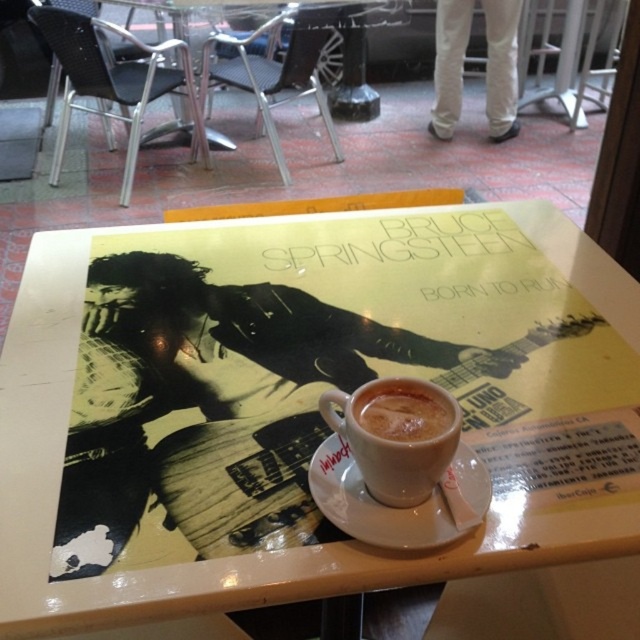
Question: Observing the image, what is the correct spatial positioning of cappuccino foam cup at center in reference to white ceramic saucer at center?

Choices:
 (A) right
 (B) left

Answer: (B)

Question: Can you confirm if white glossy table at center is positioned to the right of white frothy coffee at center?

Choices:
 (A) no
 (B) yes

Answer: (A)

Question: Which of the following is the closest to the observer?

Choices:
 (A) [x=342, y=403]
 (B) [x=420, y=404]
 (C) [x=317, y=483]

Answer: (A)

Question: Which object is closer to the camera taking this photo?

Choices:
 (A) white frothy coffee at center
 (B) cappuccino foam cup at center
 (C) white glossy table at center

Answer: (C)

Question: Which point is closer to the camera?

Choices:
 (A) cappuccino foam cup at center
 (B) white glossy table at center

Answer: (B)

Question: Is cappuccino foam cup at center bigger than white ceramic saucer at center?

Choices:
 (A) yes
 (B) no

Answer: (B)